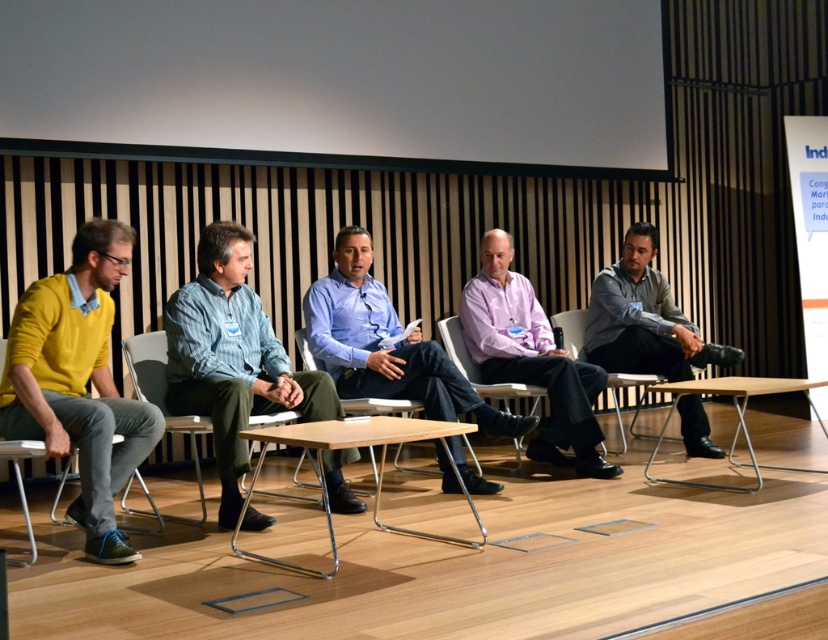
Question: Which object is farther from the camera taking this photo?

Choices:
 (A) blue striped shirt at center
 (B) matte plastic chair at center

Answer: (B)

Question: Does white plastic chair at center lie behind wooden at center?

Choices:
 (A) no
 (B) yes

Answer: (A)

Question: Can you confirm if pink shirt at center is thinner than matte plastic chair at center?

Choices:
 (A) no
 (B) yes

Answer: (A)

Question: Which object is positioned farthest from the light wood/metal table at center?

Choices:
 (A) blue shirt at center
 (B) gray matte shirt at center

Answer: (B)

Question: Which object is positioned closest to the white plastic chair at center?

Choices:
 (A) light wood/metal table at center
 (B) light brown wood table at lower right
 (C) blue shirt at center

Answer: (A)

Question: Does pink shirt at center have a smaller size compared to gray matte shirt at center?

Choices:
 (A) yes
 (B) no

Answer: (A)